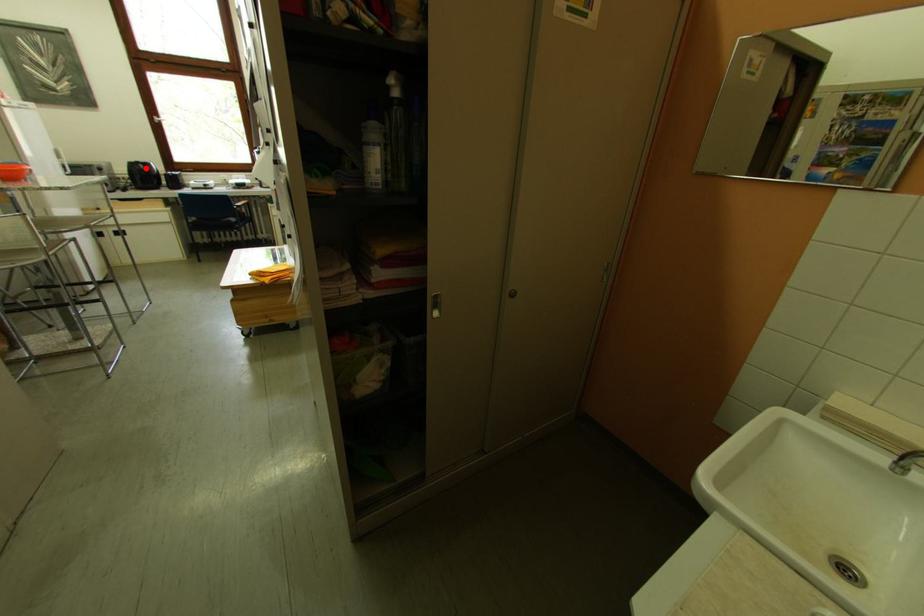
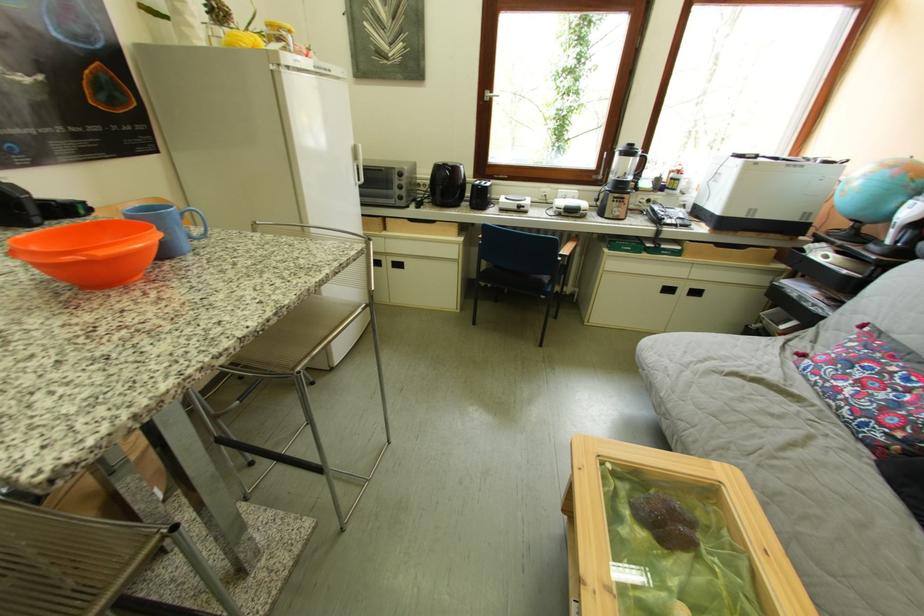
Question: I am providing you with two images of the same scene from different viewpoints. Given a red point in image1, look at the same physical point in image2. Is it:

Choices:
 (A) Closer to the viewpoint
 (B) Farther from the viewpoint

Answer: (A)